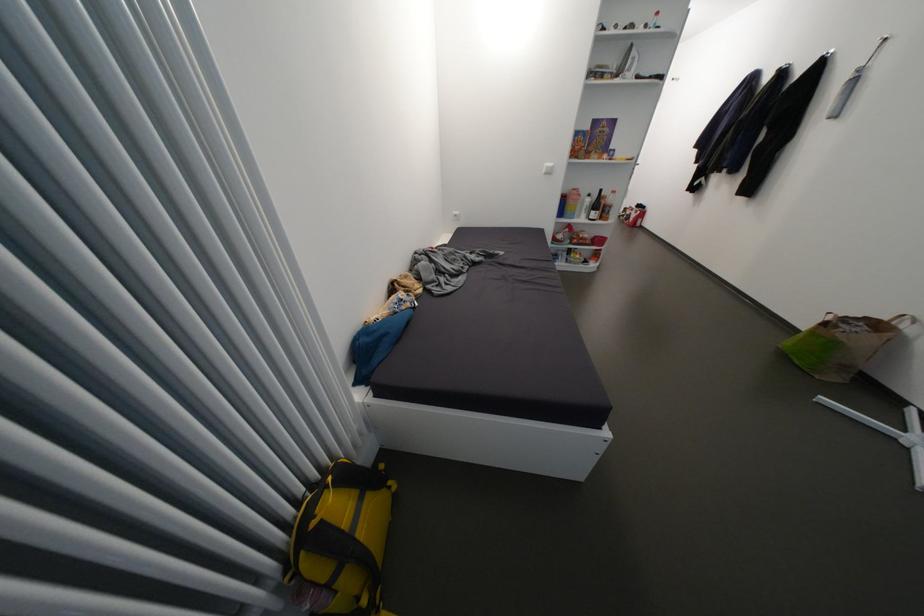
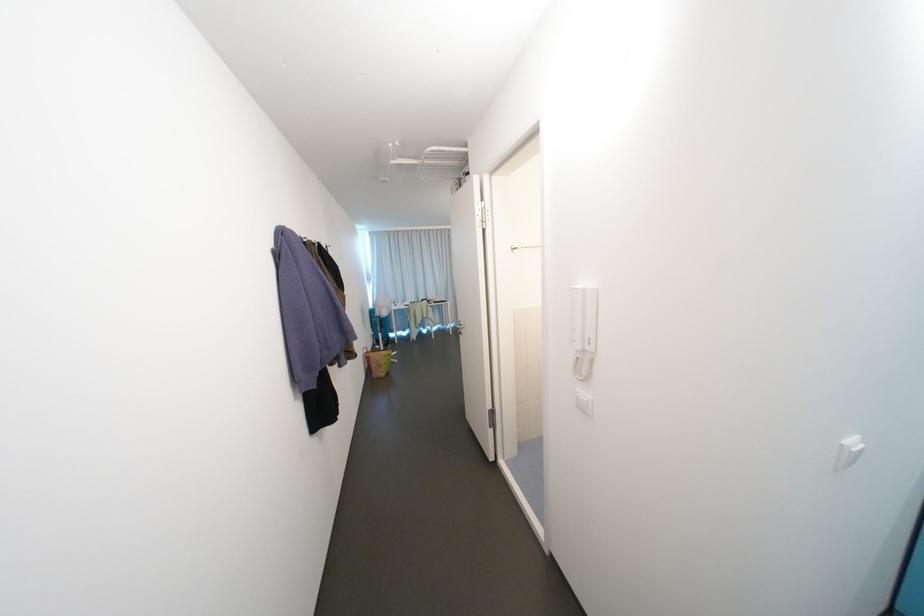
Question: I am providing you with two images of the same scene from different viewpoints. Which of the following objects are not visible in image2?

Choices:
 (A) yellow backpack
 (B) stove hood button
 (C) silver towel rack
 (D) white light switch

Answer: (A)